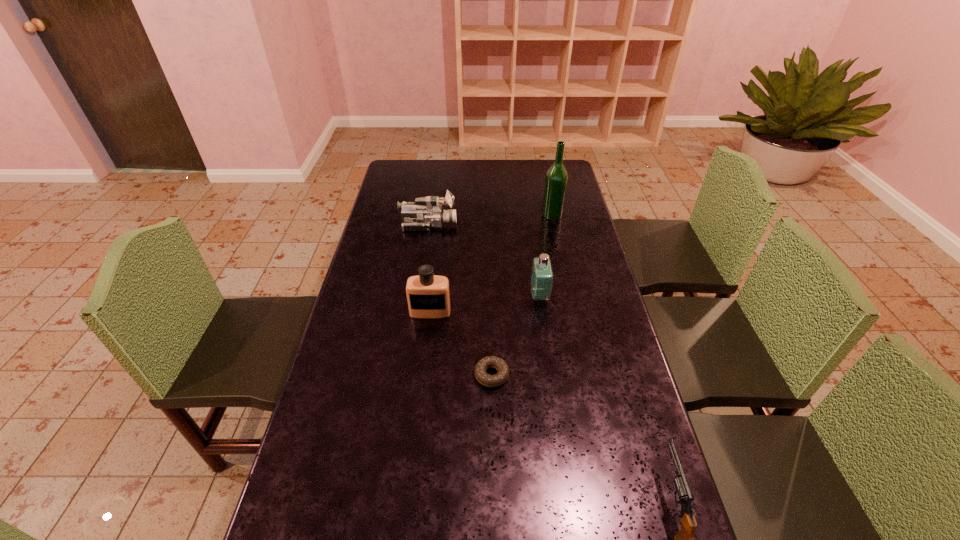
Where is `vacant area located on the front label of the fourth object from left to right`? vacant area located on the front label of the fourth object from left to right is located at coordinates (431, 295).

The image size is (960, 540). I want to click on vacant area situated on the front label of the fourth object from left to right, so click(453, 295).

Locate an element on the screen. This screenshot has height=540, width=960. free location located on the front-facing side of the camcorder is located at coordinates (477, 225).

Find the location of a particular element. This screenshot has height=540, width=960. free space located 0.160m on the right of the shortest object is located at coordinates (568, 375).

Find the location of a particular element. The image size is (960, 540). object located at the left edge is located at coordinates coord(427,212).

Find the location of `object that is positioned at the right edge`. object that is positioned at the right edge is located at coordinates (556, 179).

Locate an element on the screen. blank space at the left edge of the desktop is located at coordinates (403, 188).

You are a GUI agent. You are given a task and a screenshot of the screen. Output one action in this format:
    pyautogui.click(x=<x>, y=<y>)
    Task: Click on the free space at the right edge of the desktop
    The image size is (960, 540).
    Given the screenshot: What is the action you would take?
    pyautogui.click(x=593, y=309)

Identify the location of vacant space at the far left corner of the desktop. Image resolution: width=960 pixels, height=540 pixels. (419, 182).

This screenshot has height=540, width=960. In the image, there is a desktop. Find the location of `vacant space at the far right corner`. vacant space at the far right corner is located at coordinates (547, 162).